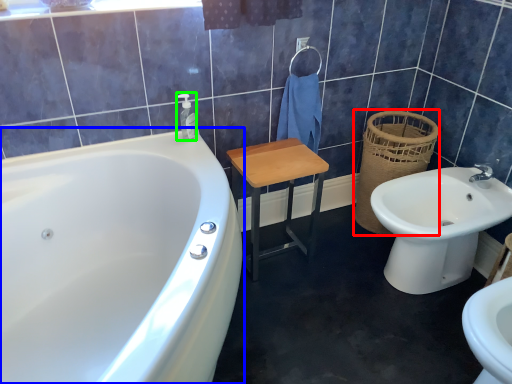
Question: Which is nearer to the basket (highlighted by a red box)? bathtub (highlighted by a blue box) or soap dispenser (highlighted by a green box).

Choices:
 (A) bathtub
 (B) soap dispenser

Answer: (B)